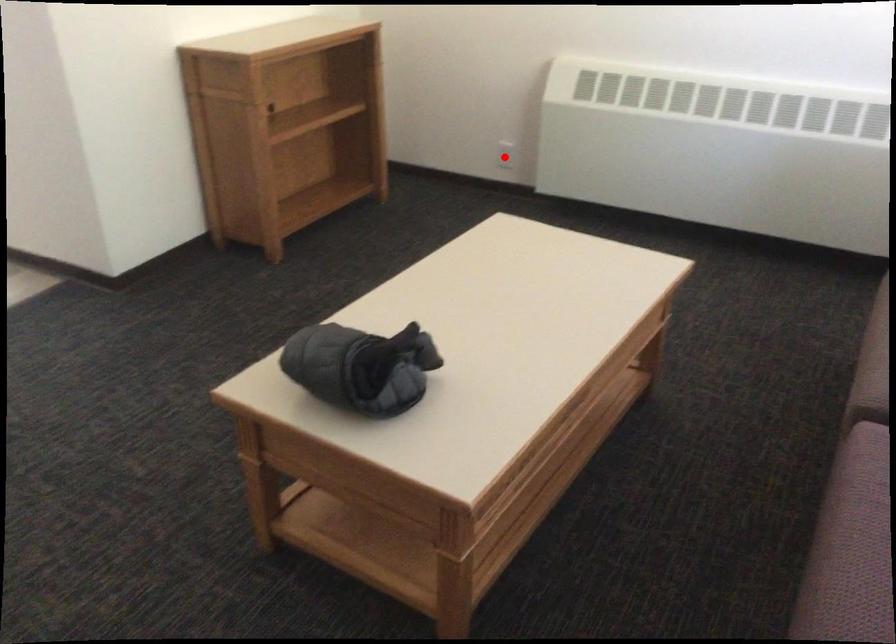
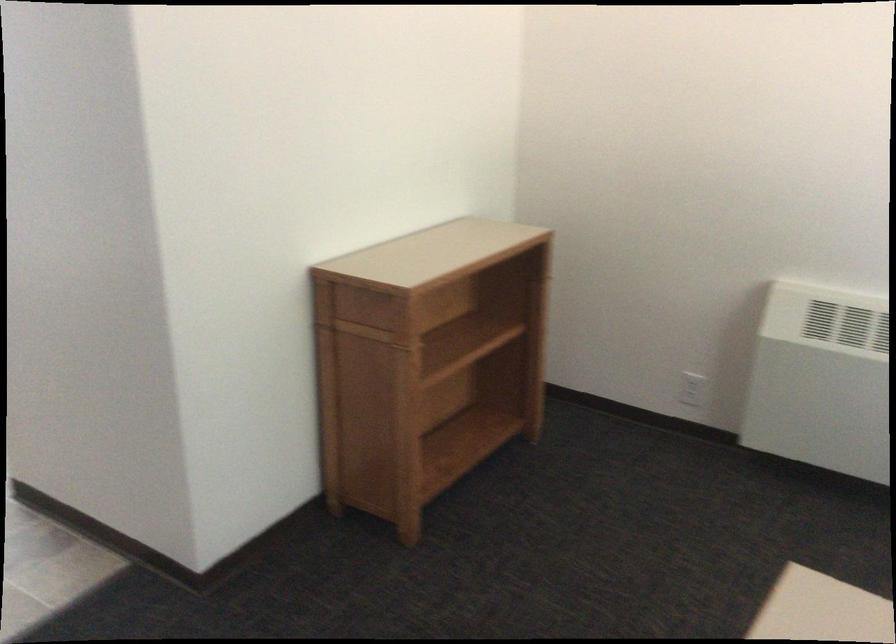
Question: I am providing you with two images of the same scene from different viewpoints. In image1, a red point is highlighted. Considering the same 3D point in image2, which of the following is correct?

Choices:
 (A) It is closer
 (B) It is farther

Answer: (A)